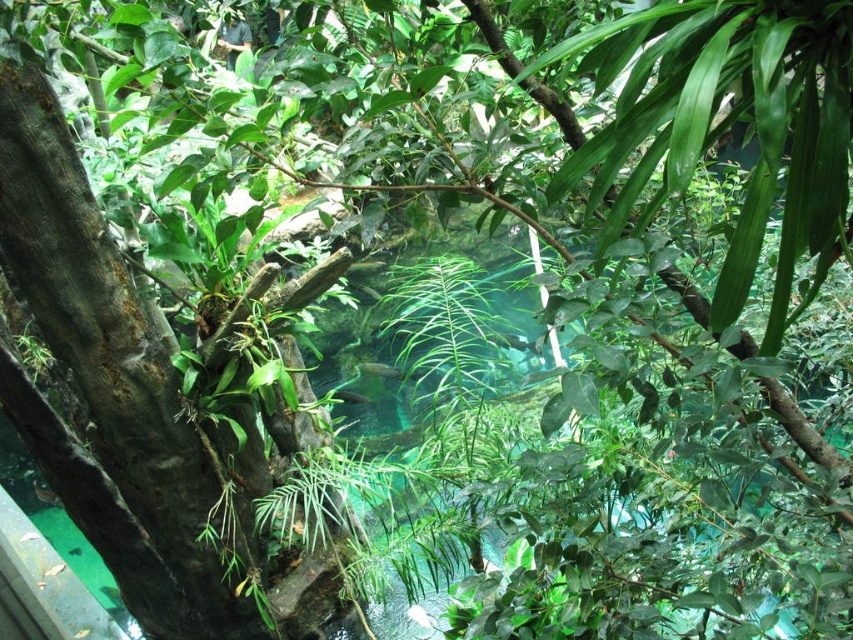
Question: Which point is closer to the camera taking this photo?

Choices:
 (A) (401, 378)
 (B) (357, 403)
 (C) (113, 588)

Answer: (C)

Question: Can you confirm if green glossy fish at center is positioned above translucent green fish at center?

Choices:
 (A) yes
 (B) no

Answer: (A)

Question: Which object is closer to the camera taking this photo?

Choices:
 (A) translucent green fish at center
 (B) green translucent fish at center
 (C) green glossy fish at center

Answer: (C)

Question: Is green glossy fish at center closer to camera compared to green translucent fish at center?

Choices:
 (A) no
 (B) yes

Answer: (B)

Question: Is green glossy fish at center thinner than translucent green fish at center?

Choices:
 (A) yes
 (B) no

Answer: (B)

Question: Which is farther from the green translucent fish at center?

Choices:
 (A) green glossy fish at center
 (B) translucent green fish at center

Answer: (B)